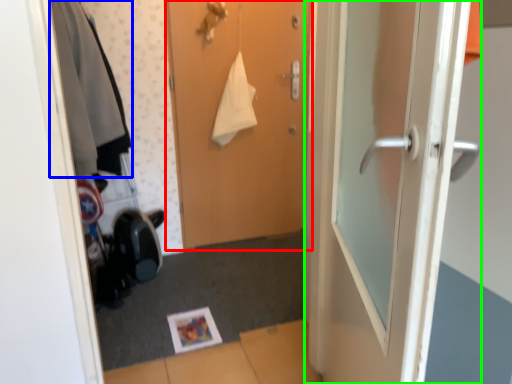
Question: Which object is the farthest from door (highlighted by a red box)? Choose among these: clothing (highlighted by a blue box) or door (highlighted by a green box).

Choices:
 (A) clothing
 (B) door

Answer: (B)